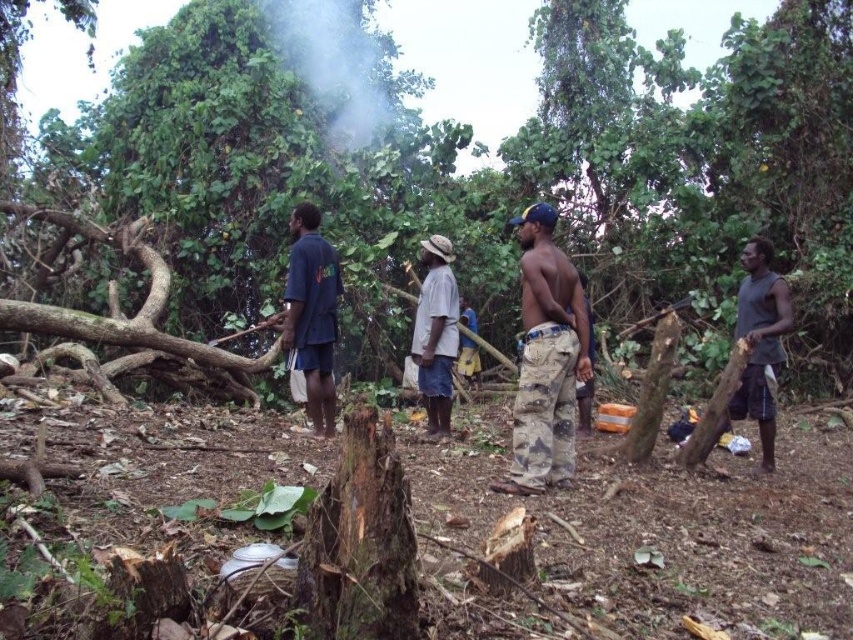
Question: Which point is farther to the camera?

Choices:
 (A) (440, 269)
 (B) (679, 180)
 (C) (747, 396)
 (D) (541, 420)

Answer: (B)

Question: Estimate the real-world distances between objects in this image. Which object is closer to the white cotton shirt at center?

Choices:
 (A) camouflage pants at center
 (B) dark blue shirt at center

Answer: (B)

Question: In this image, where is brown rough tree stump at center located relative to dark blue shirt at center?

Choices:
 (A) left
 (B) right

Answer: (A)

Question: In this image, where is brown rough tree stump at center located relative to gray sleeveless shirt at right?

Choices:
 (A) left
 (B) right

Answer: (A)

Question: Which point is closer to the camera?

Choices:
 (A) (817, 13)
 (B) (758, 241)

Answer: (B)

Question: Is brown rough tree stump at center closer to camera compared to gray sleeveless shirt at right?

Choices:
 (A) yes
 (B) no

Answer: (B)